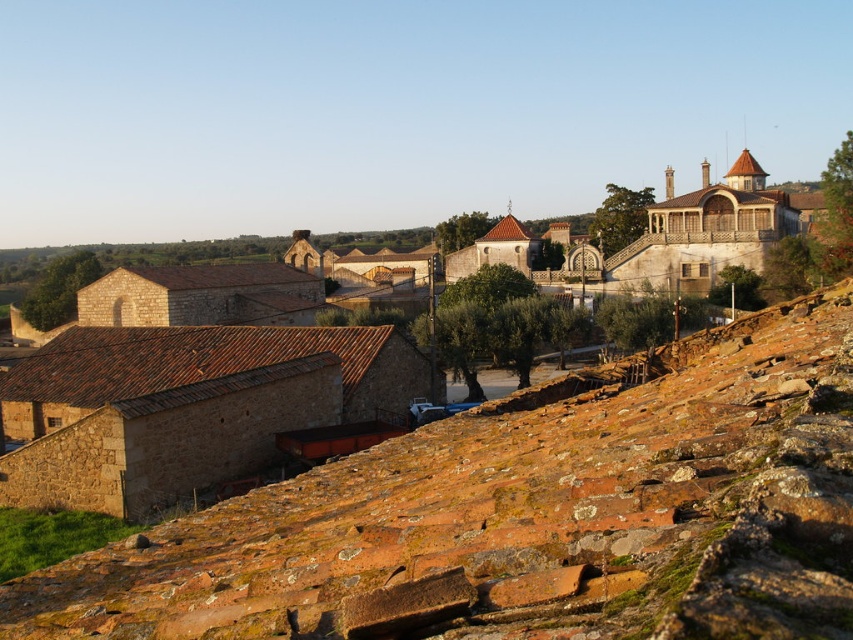
You are standing at the camera position looking at the point at coordinates (428, 444). If you walk straight towards that point, how far will you have to walk to reach it?

The point at coordinates (428, 444) is 20.15 meters away from the camera, so you will have to walk 20.15 meters to reach it.

You are standing in the rural landscape and want to take a photo of the brown stone village at center. However, you notice the brown stone hillside at lower right is blocking your view. Can you move to a position where the hillside no longer obstructs the village?

The brown stone hillside at lower right is closer to the viewer than the brown stone village at center. By moving to a higher elevation or shifting your position to the left or right, you can position yourself so that the hillside is no longer between you and the village, thus capturing the village without obstruction.

You are standing at the base of the brown stone hillside at lower right and want to reach the brown stone village at center. Which direction should you go to ascend towards the village?

You should ascend towards the north because the brown stone hillside at lower right is not as tall as the brown stone village at center, indicating the village is higher in elevation and located northward.